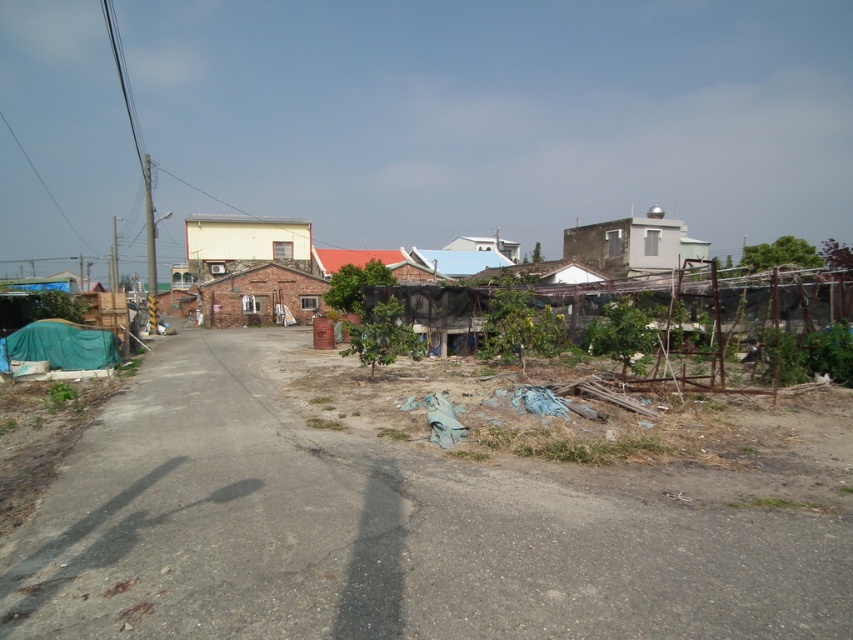
Question: Is brick house at center to the right of white matte hut at center from the viewer's perspective?

Choices:
 (A) yes
 (B) no

Answer: (B)

Question: Which object is the farthest from the white matte building at center?

Choices:
 (A) dirt road at center
 (B) brick house at center
 (C) white matte hut at center

Answer: (A)

Question: Which point is farther from the camera taking this photo?

Choices:
 (A) (252, 314)
 (B) (292, 262)
 (C) (511, 259)

Answer: (C)

Question: Is dirt road at center in front of white matte hut at center?

Choices:
 (A) yes
 (B) no

Answer: (A)

Question: Which point is farther to the camera?

Choices:
 (A) (317, 301)
 (B) (647, 269)

Answer: (B)

Question: Is white matte building at center above white smooth building at upper right?

Choices:
 (A) yes
 (B) no

Answer: (A)